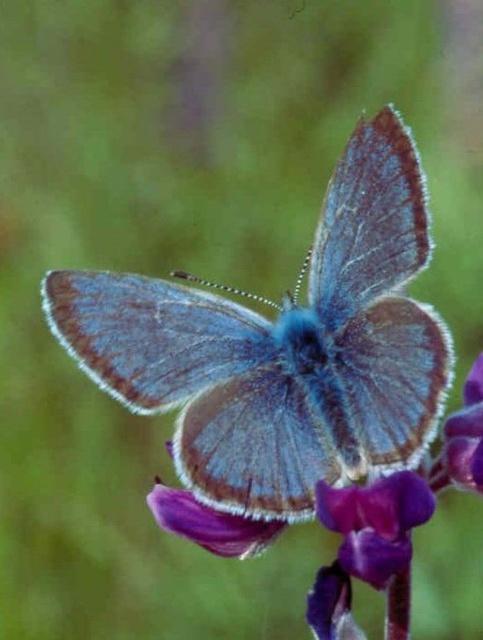
Does fuzzy blue butterfly at center come in front of purple velvet flower at center?

No, fuzzy blue butterfly at center is further to the viewer.

Can you confirm if fuzzy blue butterfly at center is thinner than purple velvet flower at center?

Incorrect, fuzzy blue butterfly at center's width is not less than purple velvet flower at center's.

Does point (252, 448) come farther from viewer compared to point (342, 536)?

That is True.

What are the coordinates of `fuzzy blue butterfly at center` in the screenshot? It's located at (284, 348).